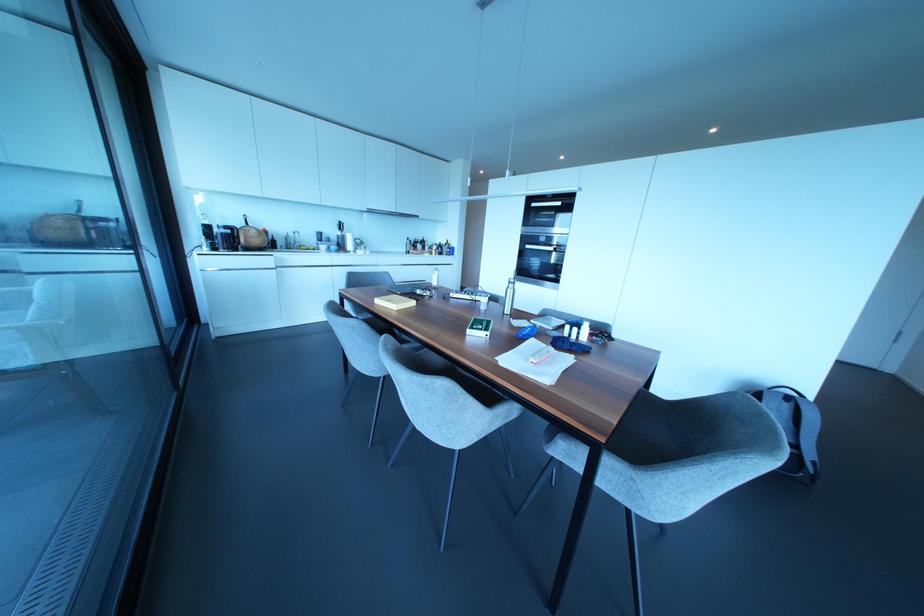
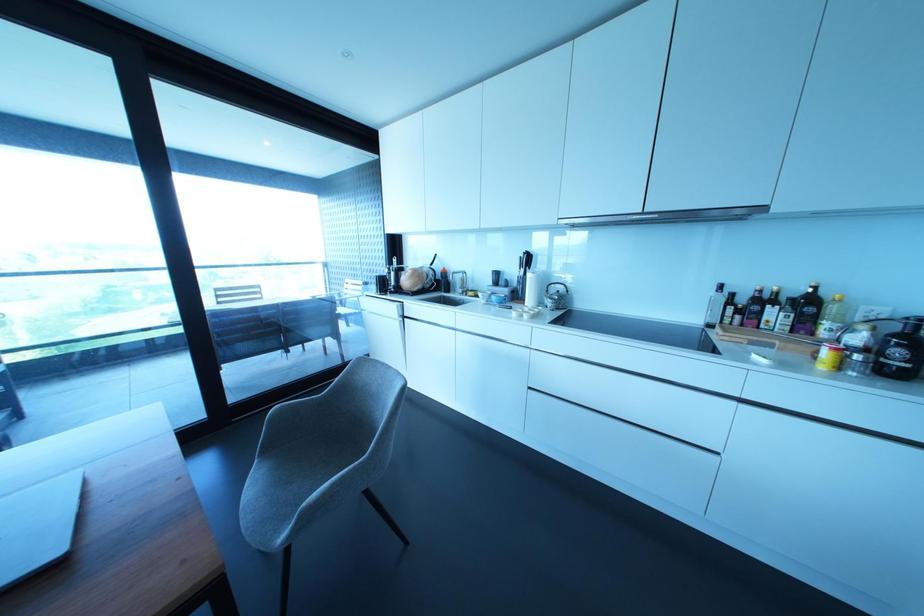
The point at (432, 251) is marked in the first image. Where is the corresponding point in the second image?

(825, 353)